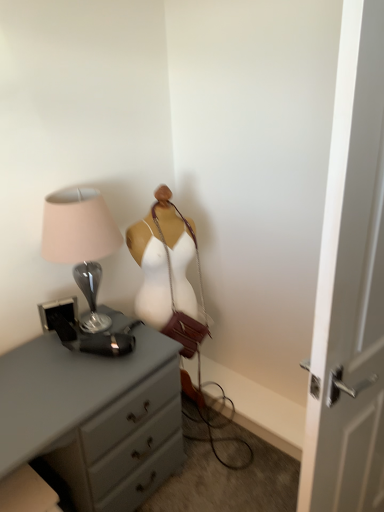
Question: From the image's perspective, would you say white wooden door at right is shown under metallic glass lamp at left?

Choices:
 (A) yes
 (B) no

Answer: (A)

Question: Can you confirm if white wooden door at right is positioned to the left of metallic glass lamp at left?

Choices:
 (A) yes
 (B) no

Answer: (B)

Question: Is the depth of white wooden door at right less than that of metallic glass lamp at left?

Choices:
 (A) yes
 (B) no

Answer: (A)

Question: Is white wooden door at right positioned far away from metallic glass lamp at left?

Choices:
 (A) yes
 (B) no

Answer: (B)

Question: Considering the relative sizes of white wooden door at right and metallic glass lamp at left in the image provided, is white wooden door at right smaller than metallic glass lamp at left?

Choices:
 (A) yes
 (B) no

Answer: (B)

Question: Is white wooden door at right next to metallic glass lamp at left and touching it?

Choices:
 (A) no
 (B) yes

Answer: (A)

Question: Is gray matte chest of drawers at left further to camera compared to white wooden door at right?

Choices:
 (A) yes
 (B) no

Answer: (A)

Question: Is gray matte chest of drawers at left to the right of white wooden door at right from the viewer's perspective?

Choices:
 (A) no
 (B) yes

Answer: (A)

Question: Is there a large distance between gray matte chest of drawers at left and white wooden door at right?

Choices:
 (A) no
 (B) yes

Answer: (A)

Question: Is gray matte chest of drawers at left taller than white wooden door at right?

Choices:
 (A) no
 (B) yes

Answer: (A)

Question: Considering the relative sizes of gray matte chest of drawers at left and white wooden door at right in the image provided, is gray matte chest of drawers at left thinner than white wooden door at right?

Choices:
 (A) no
 (B) yes

Answer: (A)

Question: From a real-world perspective, does gray matte chest of drawers at left stand above white wooden door at right?

Choices:
 (A) no
 (B) yes

Answer: (A)

Question: From a real-world perspective, is metallic glass lamp at left under gray matte chest of drawers at left?

Choices:
 (A) no
 (B) yes

Answer: (A)